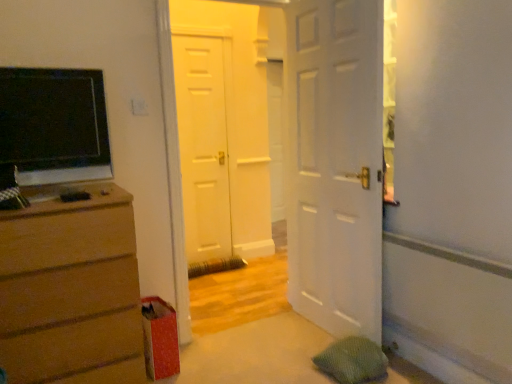
The image size is (512, 384). Identify the location of vacant space behind white matte door at center, the 2th door positioned from the back. (245, 299).